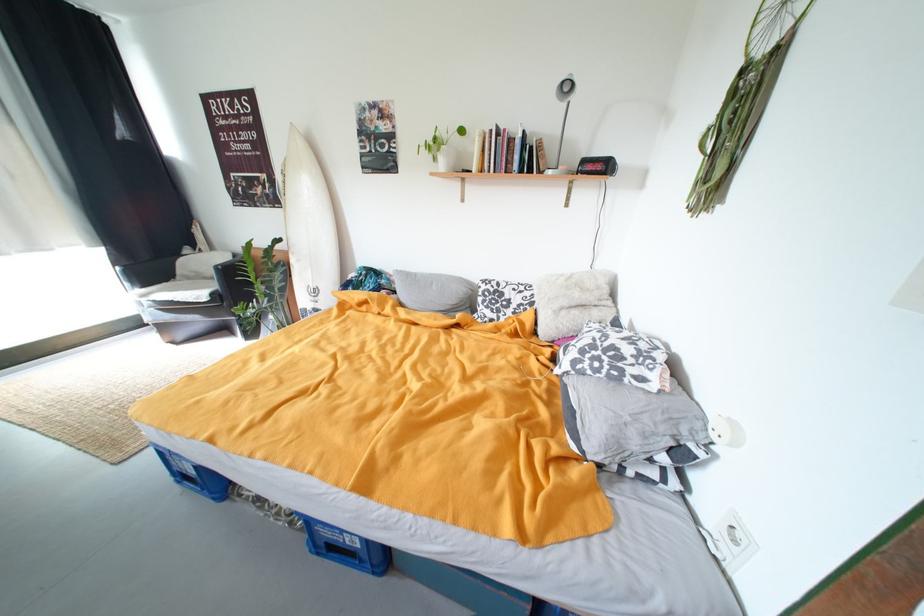
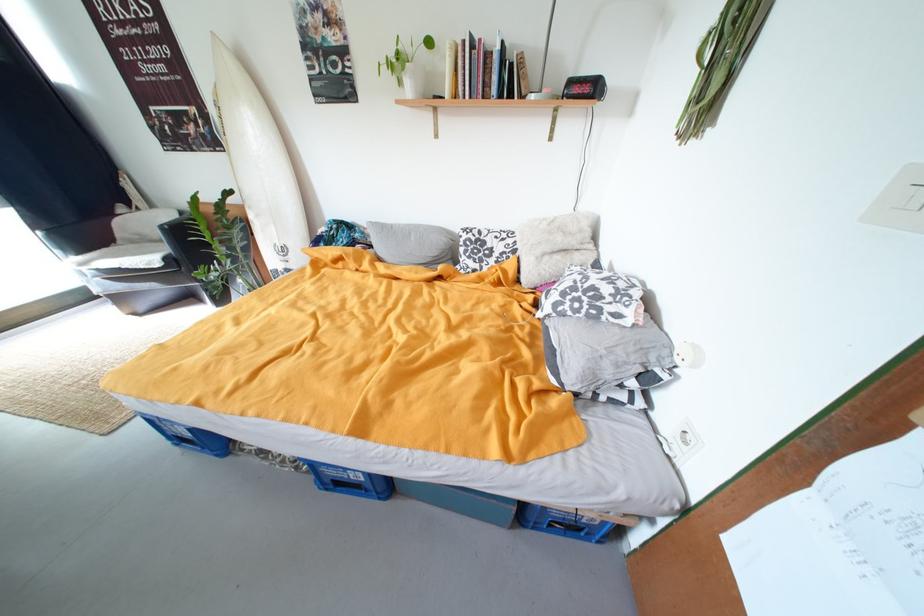
Where in the second image is the point corresponding to point 450,166 from the first image?

(418, 90)